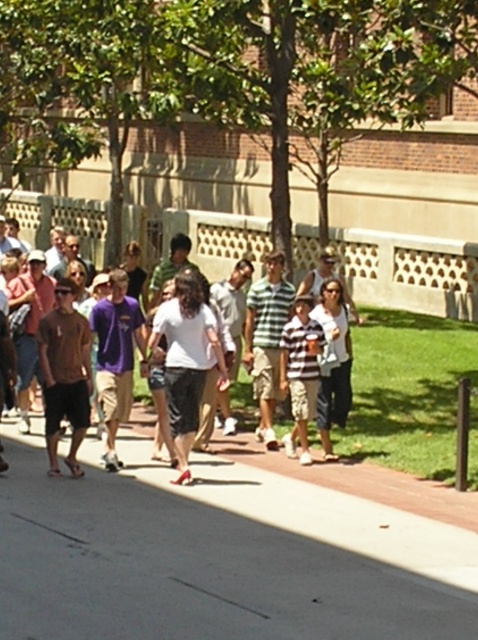
Question: Can you confirm if white cotton shirt at center is positioned above striped fabric shirt at center?

Choices:
 (A) yes
 (B) no

Answer: (A)

Question: Which of the following is the closest to the observer?

Choices:
 (A) white cotton shirt at center
 (B) striped fabric shirt at center

Answer: (B)

Question: Which point is closer to the camera taking this photo?

Choices:
 (A) (221, 241)
 (B) (308, 358)

Answer: (B)

Question: Is gray concrete sidewalk at center to the left of striped fabric shirt at center from the viewer's perspective?

Choices:
 (A) no
 (B) yes

Answer: (B)

Question: Does white cotton shirt at center have a greater width compared to striped fabric shirt at center?

Choices:
 (A) yes
 (B) no

Answer: (A)

Question: Which is farther from the gray concrete sidewalk at center?

Choices:
 (A) striped fabric shirt at center
 (B) white cotton shirt at center

Answer: (B)